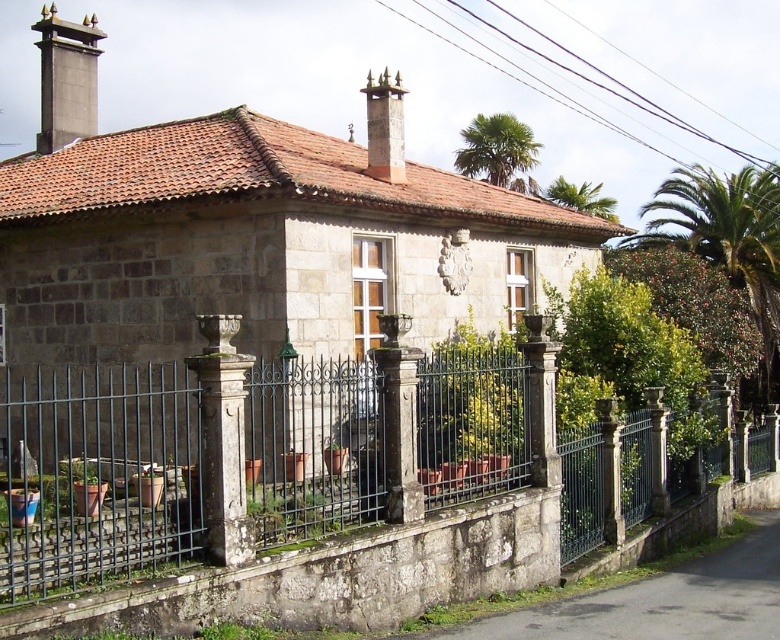
Question: Is smooth gray chimney at upper left to the left of green leafy palm at upper center from the viewer's perspective?

Choices:
 (A) yes
 (B) no

Answer: (A)

Question: Is smooth gray chimney at upper center above green leafy palm tree at upper right?

Choices:
 (A) no
 (B) yes

Answer: (B)

Question: Is the position of green wrought iron fence at center less distant than that of green leafy palm tree at upper right?

Choices:
 (A) no
 (B) yes

Answer: (B)

Question: Which point is farther to the camera?

Choices:
 (A) green leafy palm tree at upper right
 (B) green leafy palm at upper center

Answer: (B)

Question: Which of these objects is positioned farthest from the green leafy palm at upper center?

Choices:
 (A) green leafy palm tree at upper right
 (B) smooth gray chimney at upper center
 (C) smooth gray chimney at upper left
 (D) green leafy palm at upper right

Answer: (C)

Question: Among these objects, which one is farthest from the camera?

Choices:
 (A) green leafy palm at upper center
 (B) green leafy palm tree at upper right

Answer: (A)